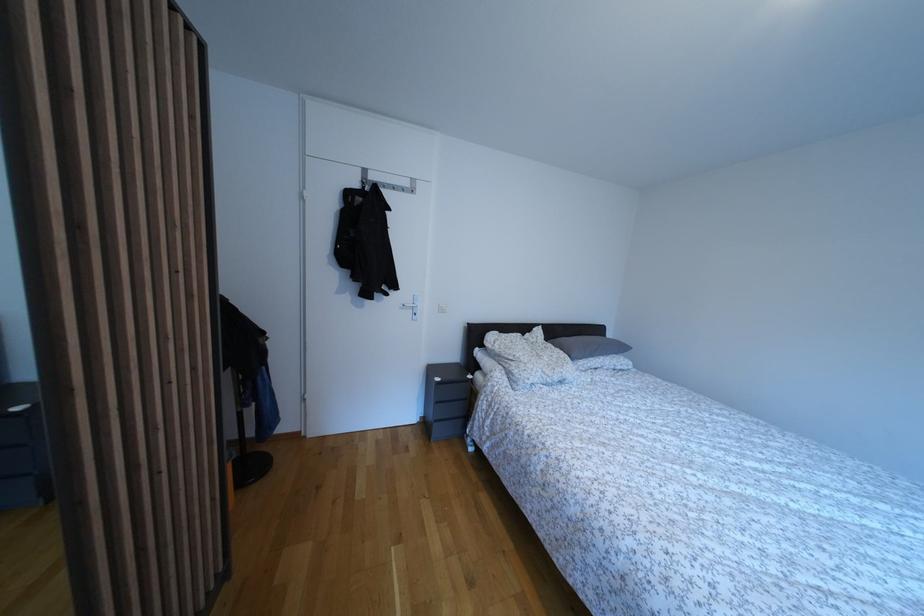
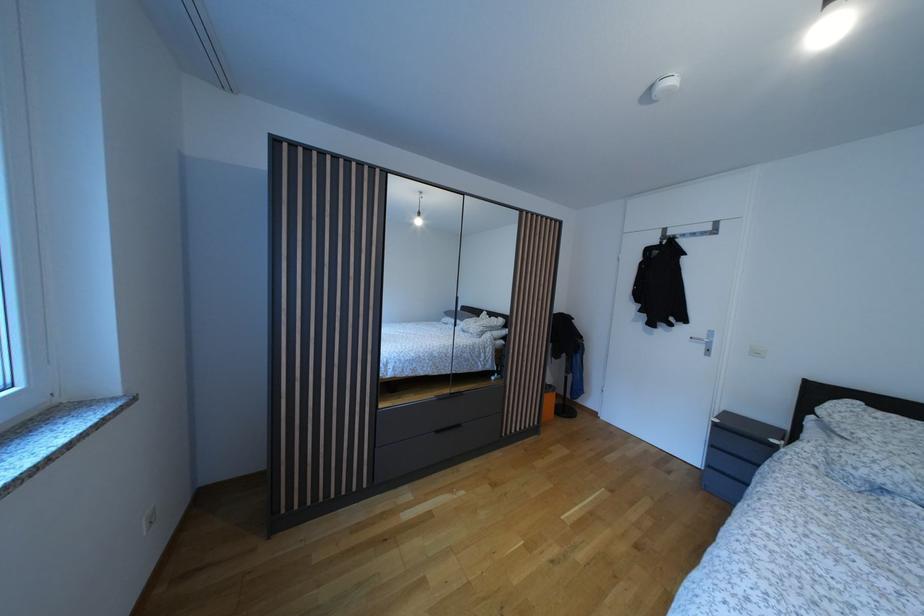
Find the pixel in the second image that matches point 444,386 in the first image.

(723, 427)